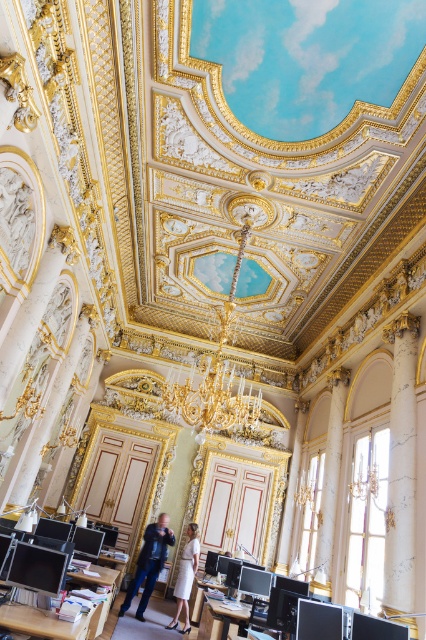
You are standing in the center of the room and notice both the gold metallic chandelier at center and the matte black jacket at center. Which object is positioned to the right of the other?

The gold metallic chandelier at center is to the right of the matte black jacket at center.

You are an interior designer planning to install a new light fixture in the room. The current gold metallic chandelier at center is shorter than the white marble pillar at center. If you want the new fixture to be taller than the pillar, would the existing chandelier be a suitable replacement?

The gold metallic chandelier at center is not as tall as the white marble pillar at center, so it would not be suitable as a replacement if you want a fixture taller than the pillar.

You are a guest at a formal event and notice the gold metallic chandelier at center and the white satin dress at center. If you want to take a photo of both objects in the same frame, would their distance require you to use a wide angle lens or a telephoto lens?

The gold metallic chandelier at center is 11.59 feet from the white satin dress at center. Since they are relatively far apart, a wide angle lens would be better to capture both in the same frame.